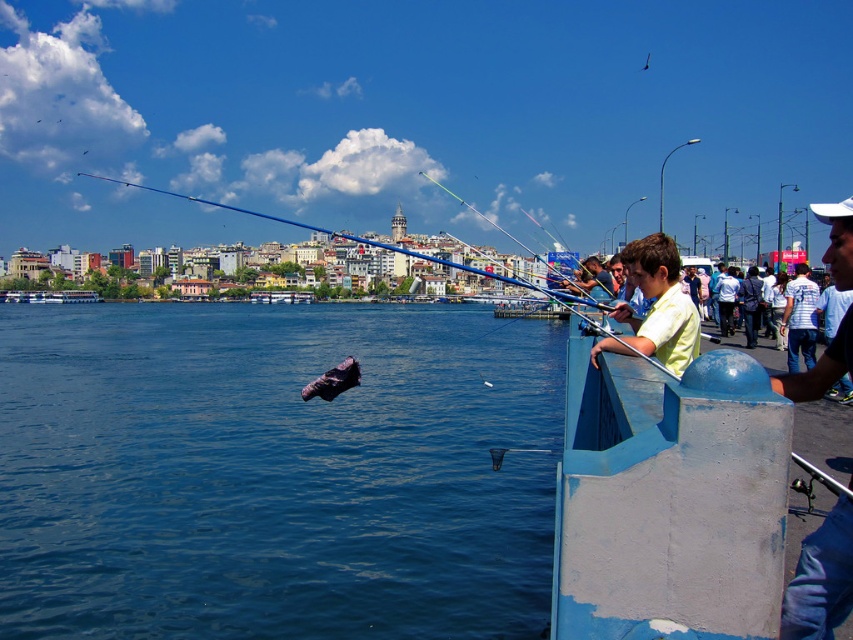
Question: Is dark blue water at center bigger than denim jeans at right?

Choices:
 (A) yes
 (B) no

Answer: (A)

Question: Can you confirm if dark blue water at center is positioned to the left of white striped shirt at right?

Choices:
 (A) yes
 (B) no

Answer: (A)

Question: Which point is closer to the camera?

Choices:
 (A) (79, 298)
 (B) (807, 355)
 (C) (306, 330)

Answer: (B)

Question: Does yellow matte shirt at center have a greater width compared to white plastic boat at left?

Choices:
 (A) no
 (B) yes

Answer: (A)

Question: Which object is the farthest from the white striped shirt at right?

Choices:
 (A) yellow matte shirt at center
 (B) dark blue water at center
 (C) white plastic boat at left
 (D) denim jeans at right

Answer: (C)

Question: Among these objects, which one is nearest to the camera?

Choices:
 (A) yellow matte shirt at center
 (B) white plastic boat at left
 (C) white striped shirt at right
 (D) dark blue water at center

Answer: (D)